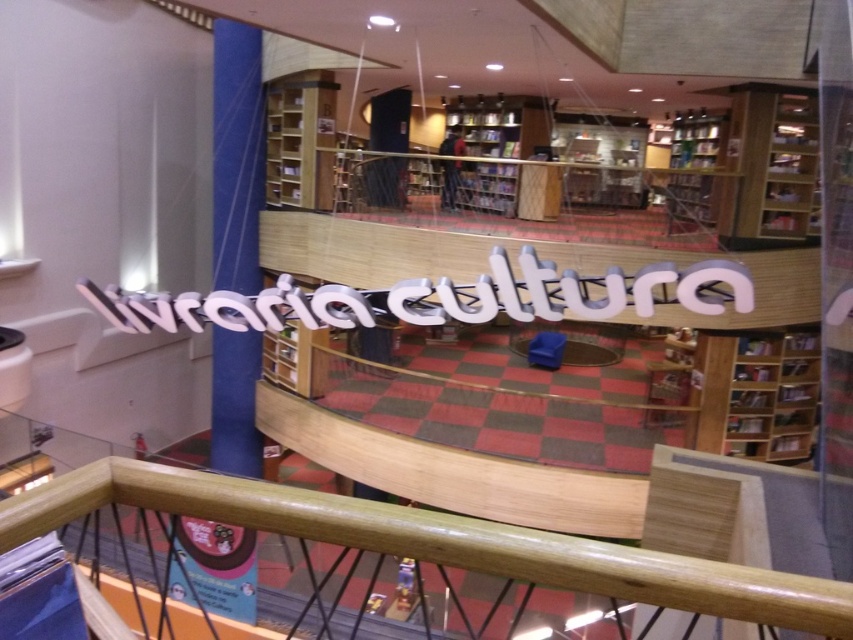
You are an interior designer planning to place a new bookshelf in the bookstore. You have two options based on the existing wooden bookshelf at center and wooden bookshelf at upper right. Which existing bookshelf should you use as a reference for size if you want the new one to be larger than both?

The wooden bookshelf at upper right is larger than the wooden bookshelf at center, so you should use the wooden bookshelf at upper right as a reference to ensure the new bookshelf is larger than both.

You are a customer in the bookstore and want to reach the wooden bookshelf at upper right to pick a book. Which direction should you move from the wooden bookshelf at lower right?

You should move upward from the wooden bookshelf at lower right to reach the wooden bookshelf at upper right since it is positioned above it.

From the picture: You are standing at the entrance of the bookstore and want to locate the wooden bookshelf at lower right. According to the coordinates provided, where should you look to find it?

You should look at point (x=755, y=394) to find the wooden bookshelf at lower right.